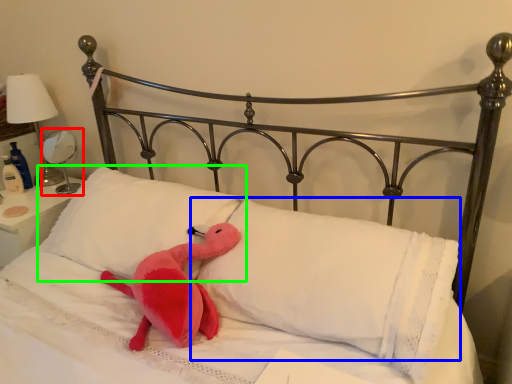
Question: Which object is the closest to the table lamp (highlighted by a red box)? Choose among these: pillow (highlighted by a blue box) or pillow (highlighted by a green box).

Choices:
 (A) pillow
 (B) pillow

Answer: (B)